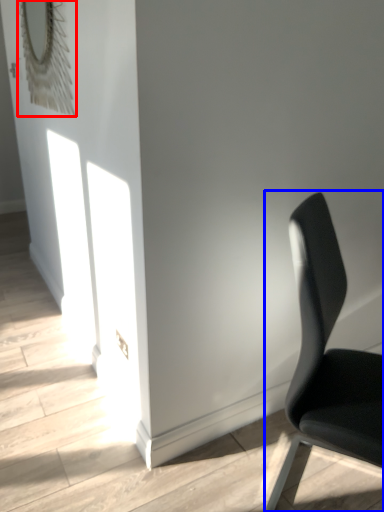
Question: Which object appears closest to the camera in this image, mirror (highlighted by a red box) or chair (highlighted by a blue box)?

Choices:
 (A) mirror
 (B) chair

Answer: (B)